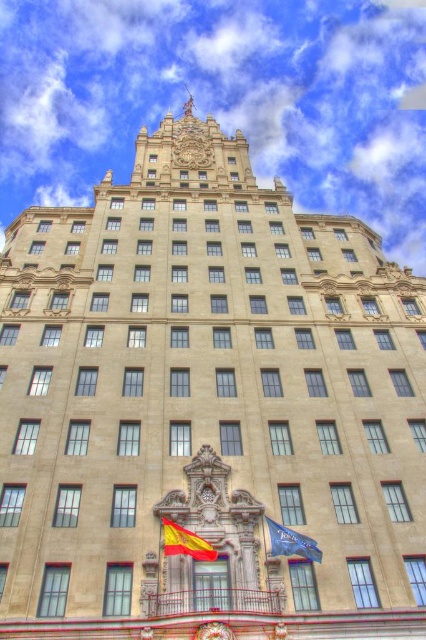
Question: Which object is farther from the camera taking this photo?

Choices:
 (A) blue fabric flag at center
 (B) red fabric flag at center

Answer: (B)

Question: Is red fabric flag at center below blue fabric flag at center?

Choices:
 (A) yes
 (B) no

Answer: (A)

Question: Does red fabric flag at center appear over blue fabric flag at center?

Choices:
 (A) no
 (B) yes

Answer: (A)

Question: Is the position of red fabric flag at center less distant than that of blue fabric flag at center?

Choices:
 (A) yes
 (B) no

Answer: (B)